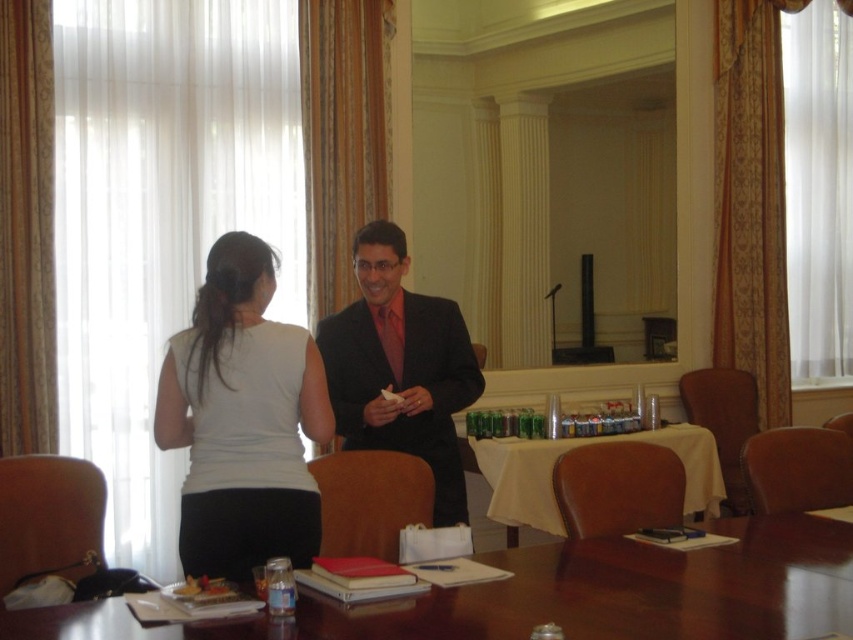
This screenshot has height=640, width=853. What do you see at coordinates (242, 419) in the screenshot?
I see `white matte shirt at upper left` at bounding box center [242, 419].

Who is more forward, (253, 524) or (717, 456)?

Point (253, 524) is more forward.

Which is behind, point (228, 330) or point (521, 493)?

Point (521, 493)

What are the coordinates of `white matte shirt at upper left` in the screenshot? It's located at (x=242, y=419).

Who is more distant from viewer, (843, 604) or (537, 452)?

Positioned behind is point (537, 452).

In order to click on shiny brown table at center in this screenshot , I will do `click(561, 595)`.

Based on the photo, can you confirm if matte black suit at center is wider than white cloth table at center?

No.

Is the position of matte black suit at center less distant than that of white cloth table at center?

Yes, it is.

Find the location of a particular element. This screenshot has width=853, height=640. matte black suit at center is located at coordinates (399, 368).

Identify the location of matte black suit at center. (399, 368).